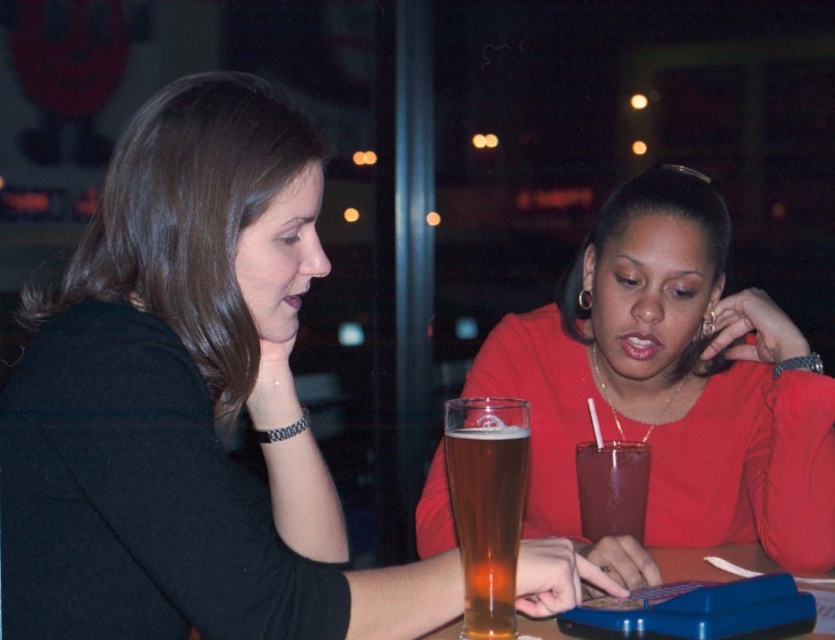
Question: Estimate the real-world distances between objects in this image. Which object is closer to the blue plastic table at center?

Choices:
 (A) dark red smooth glass at center
 (B) golden glass beer at center

Answer: (A)

Question: Which object is the farthest from the matte red blouse at center?

Choices:
 (A) dark red smooth glass at center
 (B) blue plastic table at center
 (C) golden glass beer at center

Answer: (C)

Question: Does matte red blouse at center lie behind dark red smooth glass at center?

Choices:
 (A) yes
 (B) no

Answer: (B)

Question: Is matte black shirt at center above dark red smooth glass at center?

Choices:
 (A) yes
 (B) no

Answer: (A)

Question: Does golden glass beer at center appear under dark red smooth glass at center?

Choices:
 (A) yes
 (B) no

Answer: (B)

Question: Which point appears closest to the camera in this image?

Choices:
 (A) (717, 579)
 (B) (488, 454)
 (C) (56, 298)
 (D) (634, 525)

Answer: (B)